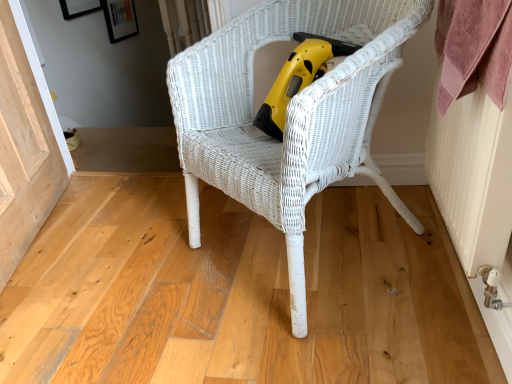
You are a GUI agent. You are given a task and a screenshot of the screen. Output one action in this format:
    pyautogui.click(x=<x>, y=<y>)
    Task: Click on the yellow plastic vacuum at center
    The image size is (512, 384).
    Given the screenshot: What is the action you would take?
    pyautogui.click(x=298, y=78)

You are a GUI agent. You are given a task and a screenshot of the screen. Output one action in this format:
    pyautogui.click(x=<x>, y=<y>)
    Task: Click on the white wicker chair at center
    The image size is (512, 384).
    Given the screenshot: What is the action you would take?
    pyautogui.click(x=288, y=115)

Find the location of `vacuum above the white wicker chair at center (from a real-world perspective)`. vacuum above the white wicker chair at center (from a real-world perspective) is located at coordinates (298, 78).

Is white wicker chair at center facing towards yellow plastic vacuum at center?

Yes, white wicker chair at center is aimed at yellow plastic vacuum at center.

Does white wicker chair at center have a smaller size compared to yellow plastic vacuum at center?

No, white wicker chair at center is not smaller than yellow plastic vacuum at center.

Relative to yellow plastic vacuum at center, is white wicker chair at center in front or behind?

Clearly, white wicker chair at center is in front of yellow plastic vacuum at center.

Is white wicker chair at center with natural wood screen door at lower left?

white wicker chair at center is not next to natural wood screen door at lower left, and they're not touching.

Who is taller, white wicker chair at center or natural wood screen door at lower left?

With more height is white wicker chair at center.

From a real-world perspective, between white wicker chair at center and natural wood screen door at lower left, who is vertically higher?

white wicker chair at center is physically above.

Is yellow plastic vacuum at center oriented towards white wicker chair at center?

Yes, yellow plastic vacuum at center is oriented towards white wicker chair at center.

From a real-world perspective, is yellow plastic vacuum at center positioned above or below white wicker chair at center?

yellow plastic vacuum at center is situated higher than white wicker chair at center in the real world.

Is point (280, 124) behind point (292, 219)?

Yes, point (280, 124) is farther from viewer.

Is natural wood screen door at lower left wider than white wicker chair at center?

No, natural wood screen door at lower left is not wider than white wicker chair at center.

Considering the positions of point (6, 271) and point (294, 5), is point (6, 271) closer or farther from the camera than point (294, 5)?

Point (6, 271).

How different are the orientations of natural wood screen door at lower left and white wicker chair at center in degrees?

146 degrees.

Is natural wood screen door at lower left next to white wicker chair at center?

natural wood screen door at lower left is not next to white wicker chair at center, and they're not touching.

Considering the relative positions of natural wood screen door at lower left and yellow plastic vacuum at center in the image provided, is natural wood screen door at lower left to the left of yellow plastic vacuum at center from the viewer's perspective?

Yes.

Is natural wood screen door at lower left facing away from yellow plastic vacuum at center?

No, natural wood screen door at lower left is not facing the opposite direction of yellow plastic vacuum at center.

Considering the positions of point (65, 166) and point (298, 46), is point (65, 166) closer or farther from the camera than point (298, 46)?

Point (65, 166) is farther from the camera than point (298, 46).

Does yellow plastic vacuum at center have a lesser height compared to natural wood screen door at lower left?

Correct, yellow plastic vacuum at center is not as tall as natural wood screen door at lower left.

From a real-world perspective, between yellow plastic vacuum at center and natural wood screen door at lower left, who is vertically higher?

yellow plastic vacuum at center.

From the picture: Between yellow plastic vacuum at center and natural wood screen door at lower left, which one has smaller size?

Smaller between the two is yellow plastic vacuum at center.

Looking at this image, from the image's perspective, which is above, yellow plastic vacuum at center or natural wood screen door at lower left?

yellow plastic vacuum at center.

Locate an element on the screen. The width and height of the screenshot is (512, 384). chair in front of the yellow plastic vacuum at center is located at coordinates (288, 115).

In the image, there is a white wicker chair at center. Where is `screen door below it (from a real-world perspective)`? This screenshot has width=512, height=384. screen door below it (from a real-world perspective) is located at coordinates (24, 145).

Looking at this image, based on their spatial positions, is natural wood screen door at lower left or yellow plastic vacuum at center further from white wicker chair at center?

natural wood screen door at lower left is positioned further to the anchor white wicker chair at center.

Which object lies nearer to the anchor point yellow plastic vacuum at center, natural wood screen door at lower left or white wicker chair at center?

The object closer to yellow plastic vacuum at center is white wicker chair at center.

From the image, which object appears to be farther from yellow plastic vacuum at center, white wicker chair at center or natural wood screen door at lower left?

Based on the image, natural wood screen door at lower left appears to be further to yellow plastic vacuum at center.

When comparing their distances from white wicker chair at center, does yellow plastic vacuum at center or natural wood screen door at lower left seem further?

natural wood screen door at lower left lies further to white wicker chair at center than the other object.

Estimate the real-world distances between objects in this image. Which object is further from natural wood screen door at lower left, white wicker chair at center or yellow plastic vacuum at center?

yellow plastic vacuum at center is further to natural wood screen door at lower left.

Based on their spatial positions, is yellow plastic vacuum at center or white wicker chair at center closer to natural wood screen door at lower left?

white wicker chair at center is closer to natural wood screen door at lower left.

This screenshot has height=384, width=512. I want to click on vacuum between natural wood screen door at lower left and white wicker chair at center in the horizontal direction, so click(x=298, y=78).